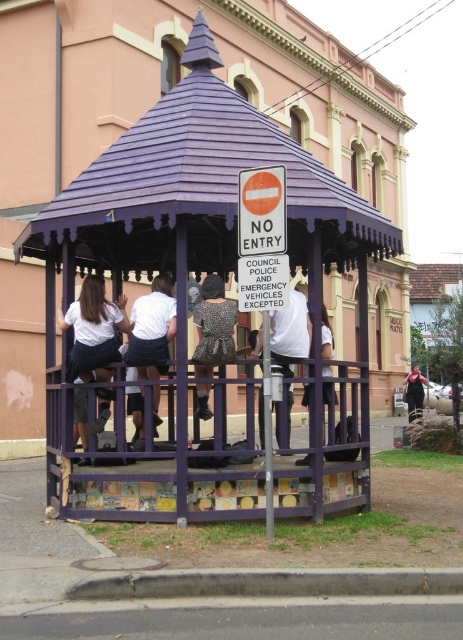
Question: Can you confirm if matte white shirt at center is smaller than printed fabric dress at center?

Choices:
 (A) yes
 (B) no

Answer: (A)

Question: Observing the image, what is the correct spatial positioning of white matte shirt at center in reference to black fabric person at lower right?

Choices:
 (A) right
 (B) left

Answer: (B)

Question: Which object is positioned closest to the white fabric shirt at center?

Choices:
 (A) black fabric person at lower right
 (B) printed fabric dress at center
 (C) matte white shirt at center

Answer: (B)

Question: Which of the following is the closest to the observer?

Choices:
 (A) matte white shirt at center
 (B) printed fabric dress at center
 (C) white fabric shirt at center
 (D) purple painted wood gazebo at center

Answer: (D)

Question: Can you confirm if matte white shirt at center is positioned to the left of black fabric person at lower right?

Choices:
 (A) yes
 (B) no

Answer: (A)

Question: Among these objects, which one is farthest from the camera?

Choices:
 (A) white matte shirt at center
 (B) white fabric shirt at center

Answer: (B)